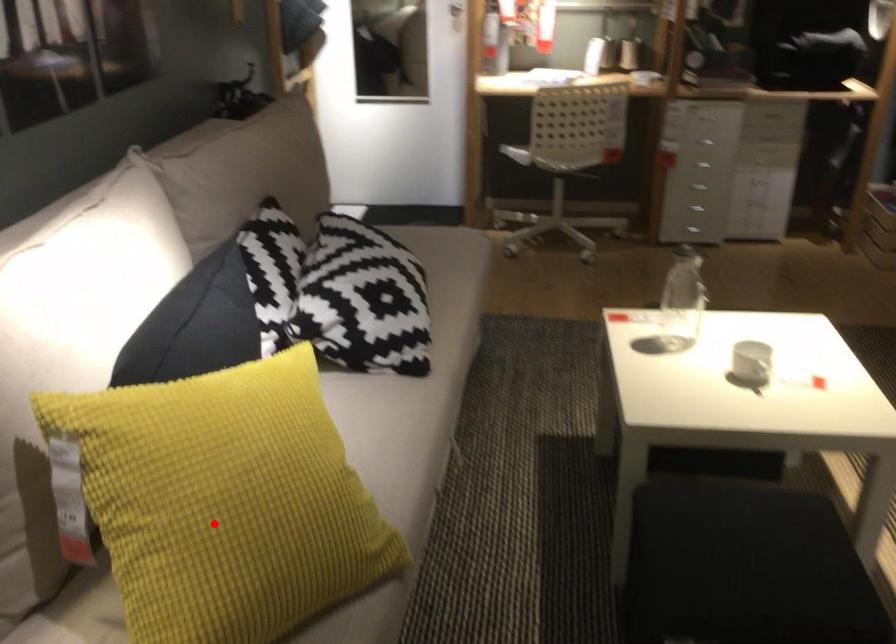
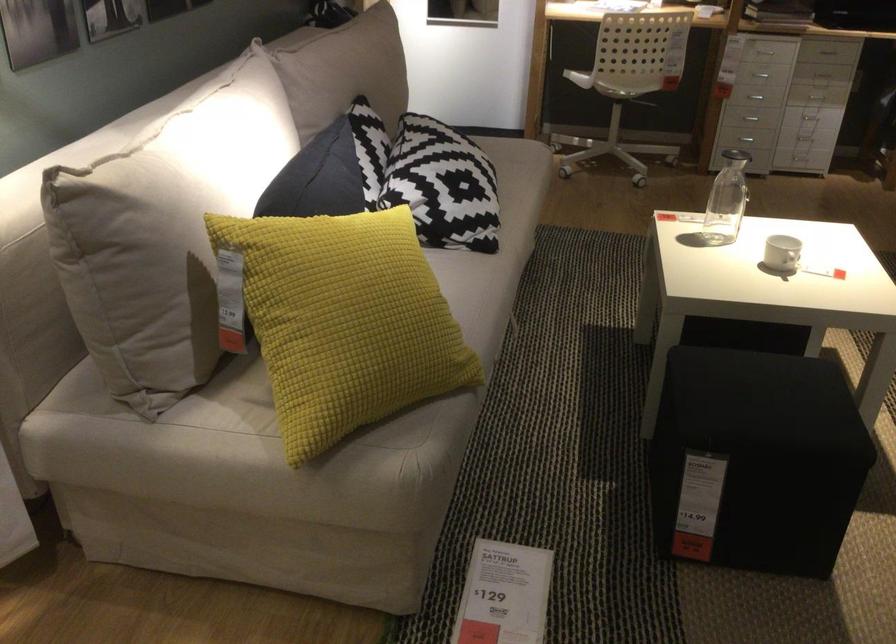
Find the pixel in the second image that matches the highlighted location in the first image.

(343, 321)